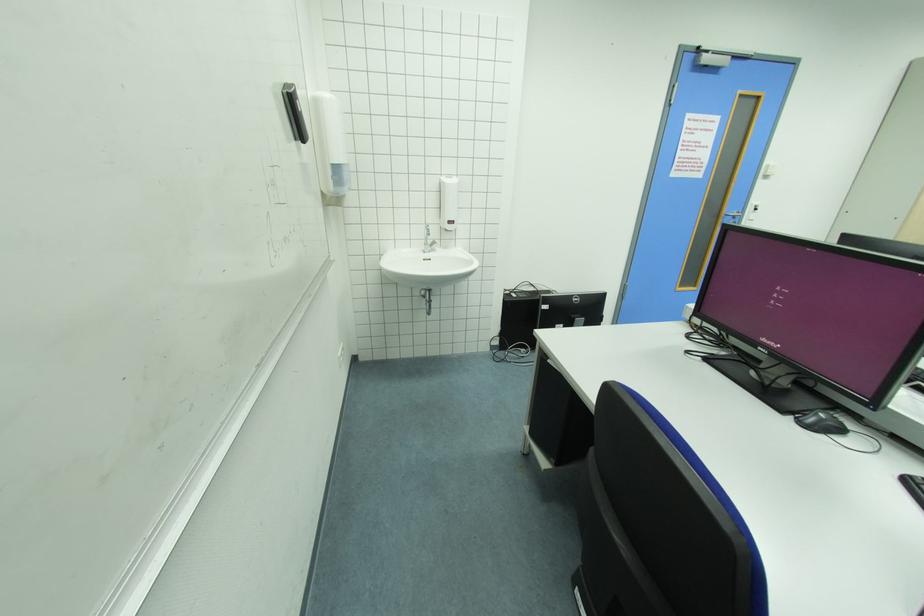
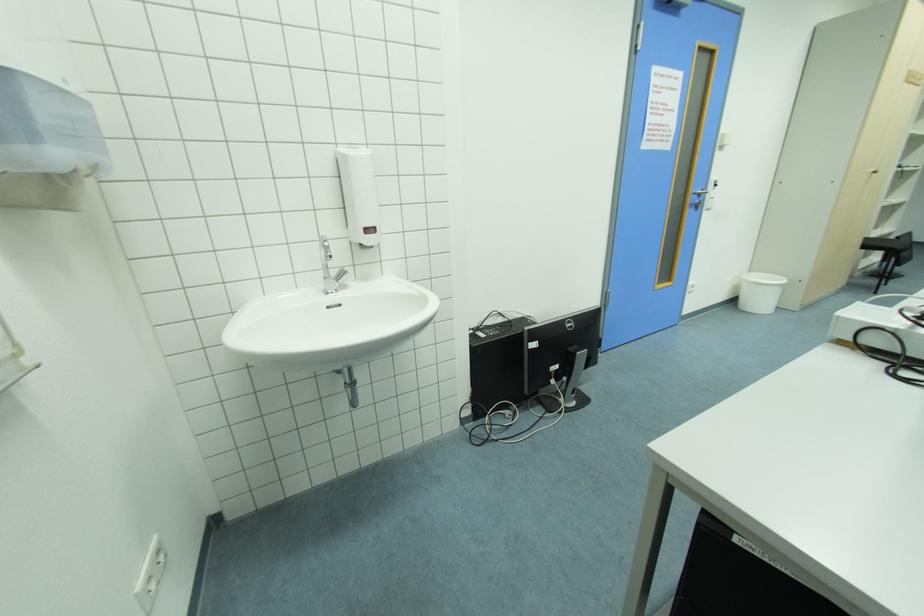
Question: The camera is either moving clockwise (left) or counter-clockwise (right) around the object. The first image is from the beginning of the video and the second image is from the end. Is the camera moving left or right when shooting the video?

Choices:
 (A) Left
 (B) Right

Answer: (A)